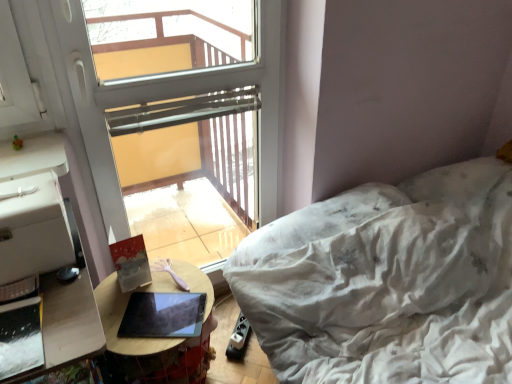
Question: From a real-world perspective, is matte black tablet at center positioned over wooden table at lower left based on gravity?

Choices:
 (A) no
 (B) yes

Answer: (B)

Question: Is matte black tablet at center not within wooden table at lower left?

Choices:
 (A) yes
 (B) no

Answer: (B)

Question: Is matte black tablet at center at the left side of wooden table at lower left?

Choices:
 (A) yes
 (B) no

Answer: (B)

Question: Could you tell me if matte black tablet at center is turned towards wooden table at lower left?

Choices:
 (A) no
 (B) yes

Answer: (B)

Question: From a real-world perspective, does matte black tablet at center sit lower than wooden table at lower left?

Choices:
 (A) yes
 (B) no

Answer: (B)

Question: Based on their positions, is transparent glass window at upper center located to the left or right of white textured bed at right?

Choices:
 (A) left
 (B) right

Answer: (A)

Question: From a real-world perspective, is transparent glass window at upper center positioned above or below white textured bed at right?

Choices:
 (A) below
 (B) above

Answer: (B)

Question: Is transparent glass window at upper center in front of or behind white textured bed at right in the image?

Choices:
 (A) behind
 (B) front

Answer: (A)

Question: Which is correct: transparent glass window at upper center is inside white textured bed at right, or outside of it?

Choices:
 (A) inside
 (B) outside

Answer: (B)

Question: From a real-world perspective, is transparent glass window at upper center above or below wooden table at lower left?

Choices:
 (A) above
 (B) below

Answer: (A)

Question: In terms of width, does transparent glass window at upper center look wider or thinner when compared to wooden table at lower left?

Choices:
 (A) thin
 (B) wide

Answer: (A)

Question: From their relative heights in the image, would you say transparent glass window at upper center is taller or shorter than wooden table at lower left?

Choices:
 (A) short
 (B) tall

Answer: (B)

Question: Is transparent glass window at upper center situated inside wooden table at lower left or outside?

Choices:
 (A) outside
 (B) inside

Answer: (A)

Question: In the image, is white textured bed at right positioned in front of or behind wooden table at lower left?

Choices:
 (A) behind
 (B) front

Answer: (B)

Question: From a real-world perspective, is white textured bed at right above or below wooden table at lower left?

Choices:
 (A) above
 (B) below

Answer: (A)